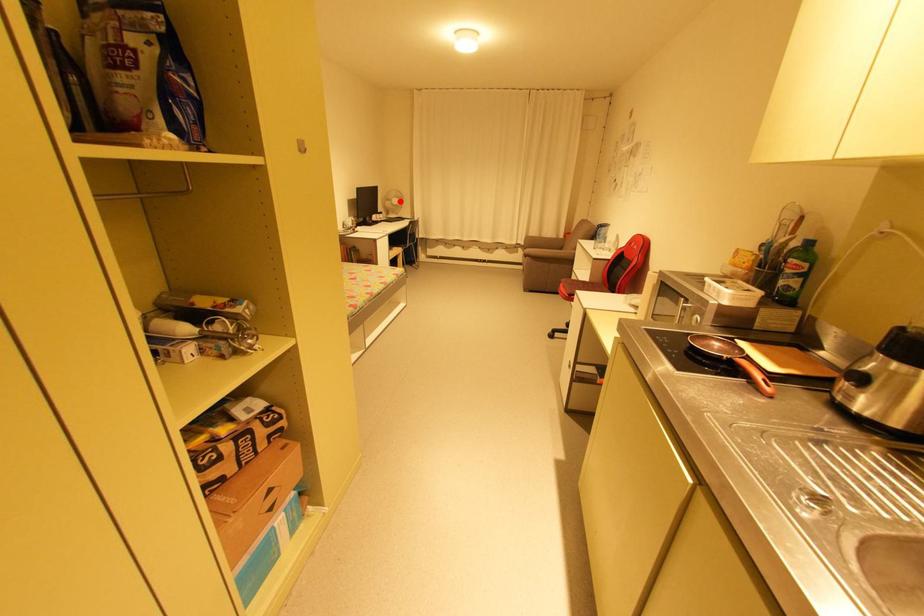
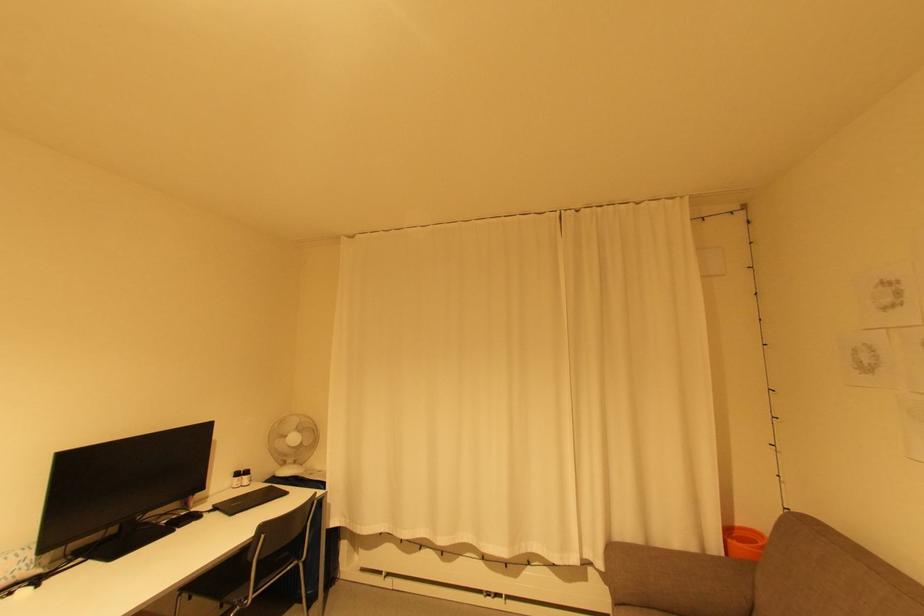
Question: I am providing you with two images of the same scene from different viewpoints. A red point is marked on the first image. Can you still see the location of the red point in image 2?

Choices:
 (A) Yes
 (B) No

Answer: (A)